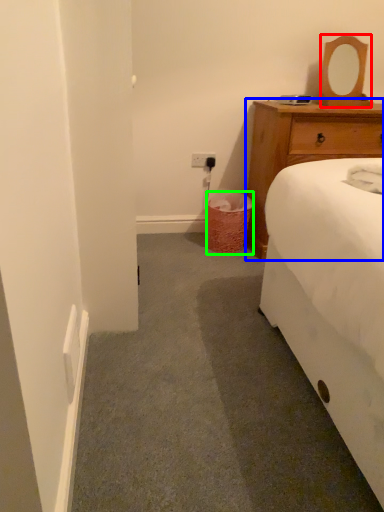
Question: Estimate the real-world distances between objects in this image. Which object is closer to mirror (highlighted by a red box), chest of drawers (highlighted by a blue box) or trash bin/can (highlighted by a green box)?

Choices:
 (A) chest of drawers
 (B) trash bin/can

Answer: (A)